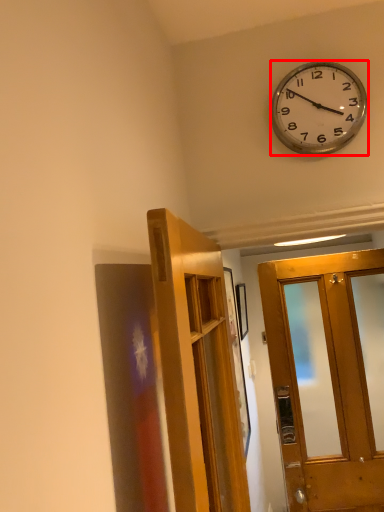
Question: In this image, where is wall clock (annotated by the red box) located relative to door?

Choices:
 (A) left
 (B) right

Answer: (B)